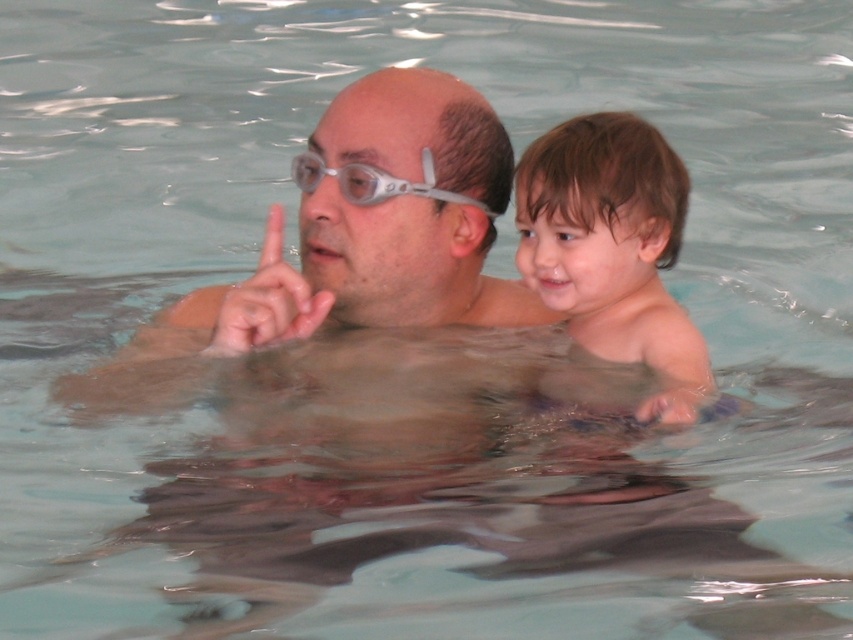
Question: Which of the following is the closest to the observer?

Choices:
 (A) (375, 176)
 (B) (653, 202)

Answer: (B)

Question: Does brown matte hair at upper right appear on the right side of clear plastic goggles at upper center?

Choices:
 (A) no
 (B) yes

Answer: (B)

Question: Which point is farther from the camera taking this photo?

Choices:
 (A) (582, 301)
 (B) (460, 200)

Answer: (B)

Question: Is the position of brown matte hair at upper right less distant than that of clear plastic goggles at upper center?

Choices:
 (A) yes
 (B) no

Answer: (A)

Question: Does brown matte hair at upper right lie behind clear plastic goggles at upper center?

Choices:
 (A) yes
 (B) no

Answer: (B)

Question: Which of the following is the farthest from the observer?

Choices:
 (A) clear plastic goggles at upper center
 (B) brown matte hair at upper right

Answer: (A)